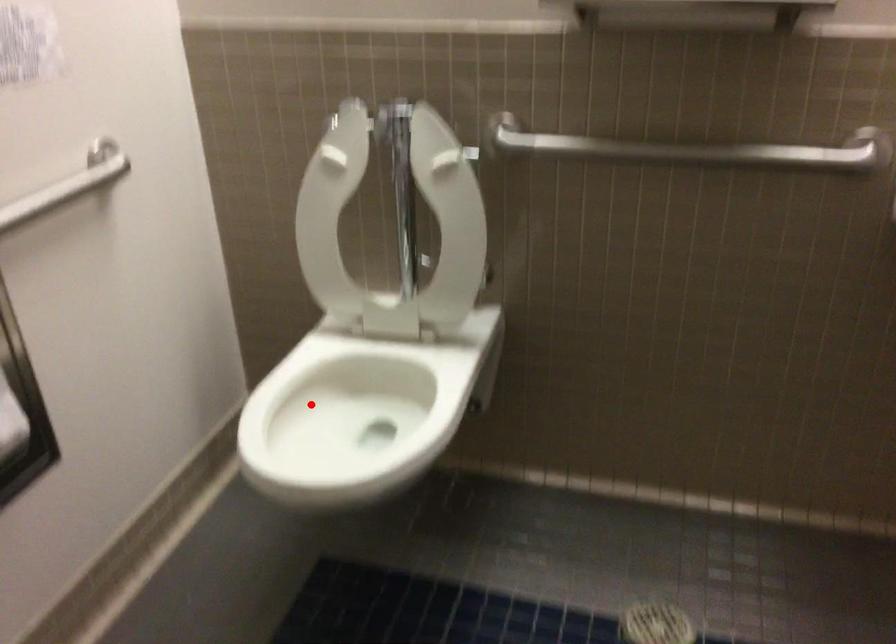
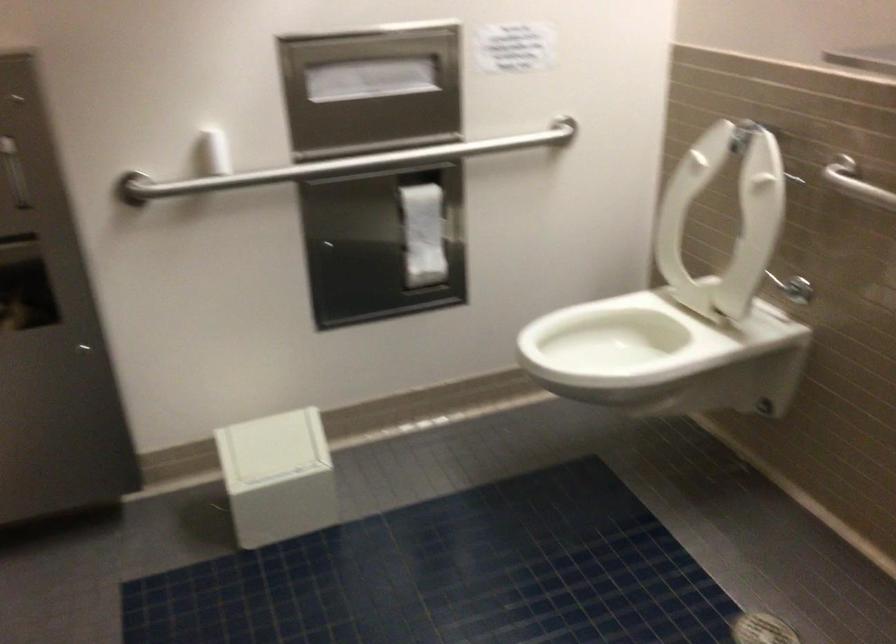
Question: I am providing you with two images of the same scene from different viewpoints. Given a red point in image1, look at the same physical point in image2. Is it:

Choices:
 (A) Closer to the viewpoint
 (B) Farther from the viewpoint

Answer: (B)